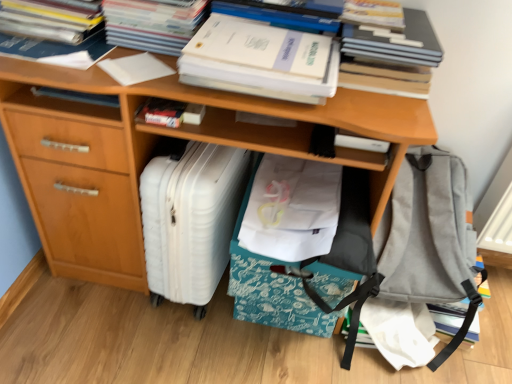
This screenshot has height=384, width=512. Find the location of `vacant space in front of white plastic suitcase at lower left`. vacant space in front of white plastic suitcase at lower left is located at coordinates [x=174, y=345].